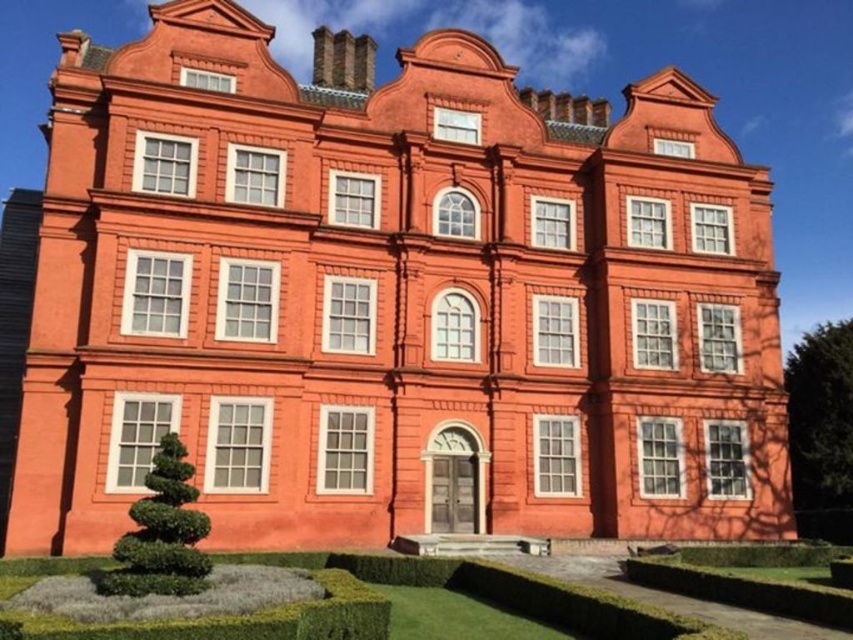
Does point (548, 609) come behind point (177, 554)?

That is True.

What do you see at coordinates (508, 593) in the screenshot?
I see `green hedge at lower center` at bounding box center [508, 593].

Where is `green hedge at lower center`? green hedge at lower center is located at coordinates (508, 593).